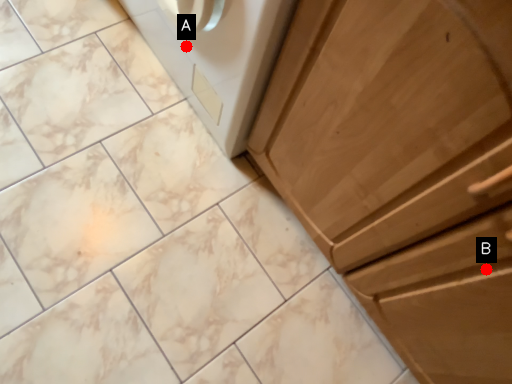
Question: Two points are circled on the image, labeled by A and B beside each circle. Which point is farther from the camera taking this photo?

Choices:
 (A) A is further
 (B) B is further

Answer: (A)